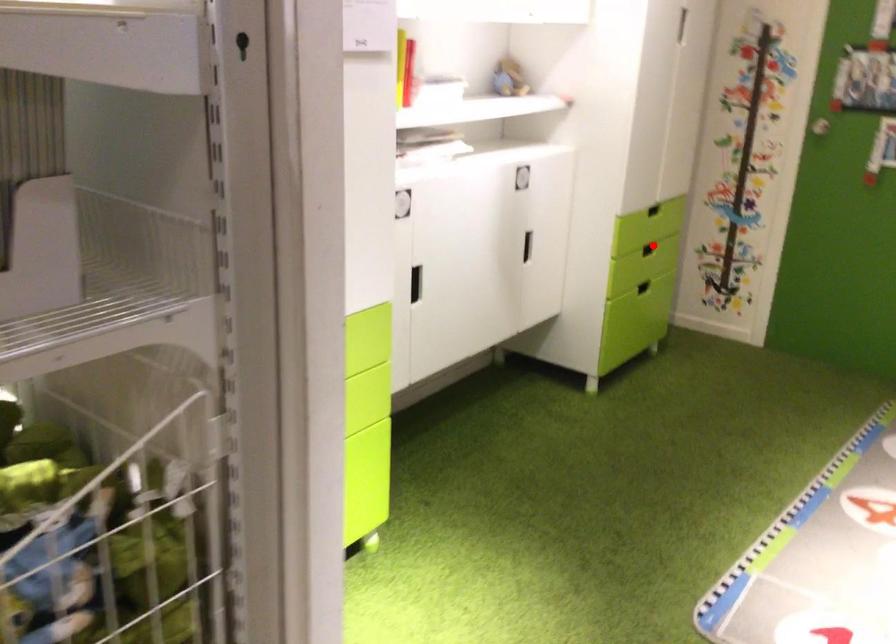
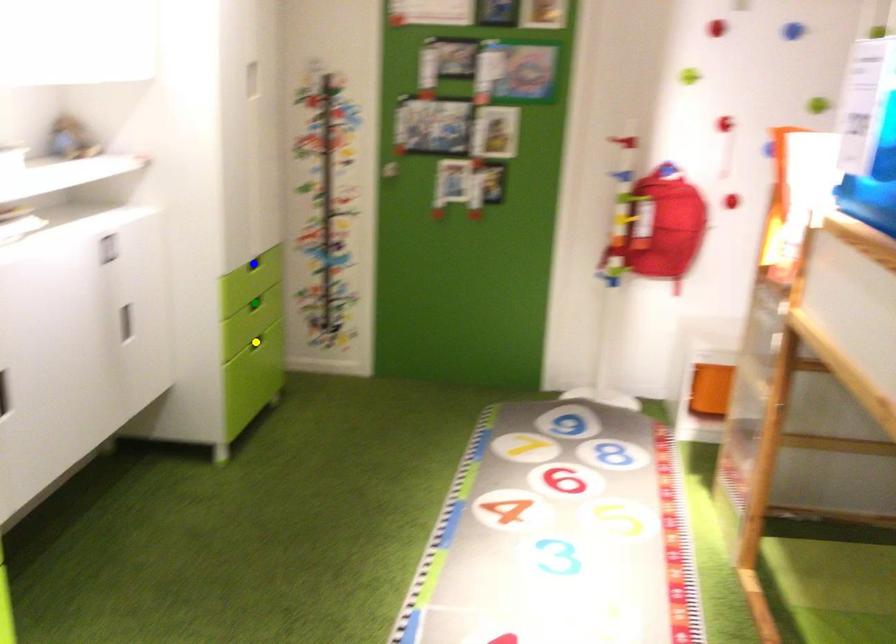
Question: I am providing you with two images of the same scene from different viewpoints. A red point is marked on the first image. You are given multiple points on the second image. In image 2, which mark is for the same physical point as the one in image 1?

Choices:
 (A) green point
 (B) blue point
 (C) yellow point

Answer: (A)